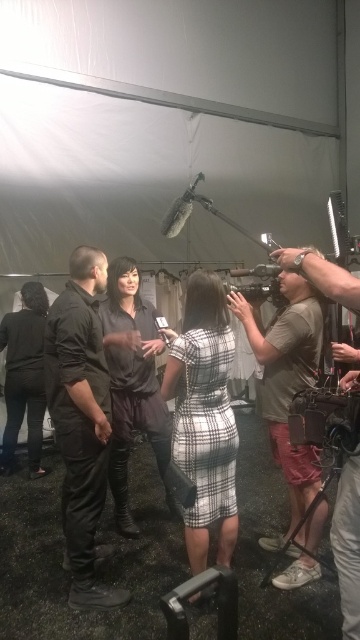
Question: Does dark brown leather boots at center appear over black leather jacket at left?

Choices:
 (A) no
 (B) yes

Answer: (B)

Question: Estimate the real-world distances between objects in this image. Which object is closer to the plaid fabric dress at center?

Choices:
 (A) black plastic video camera at center
 (B) black plastic video camera at lower right
 (C) matte black pants at center

Answer: (B)

Question: Which object is the closest to the dark brown leather boots at center?

Choices:
 (A) khaki cotton shirt at right
 (B) matte black pants at center
 (C) plaid fabric dress at center
 (D) black plastic video camera at lower right

Answer: (B)

Question: Is khaki cotton shirt at right further to the viewer compared to black plastic video camera at center?

Choices:
 (A) yes
 (B) no

Answer: (B)

Question: Which object is closer to the camera taking this photo?

Choices:
 (A) black plastic video camera at lower right
 (B) matte black pants at center
 (C) black leather jacket at left

Answer: (A)

Question: Is khaki cotton shirt at right positioned before dark brown leather boots at center?

Choices:
 (A) no
 (B) yes

Answer: (B)